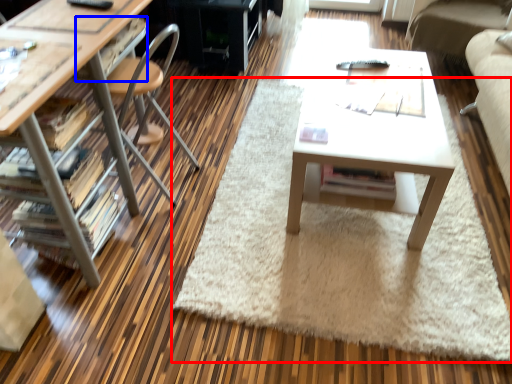
Question: Which object is further to the camera taking this photo, mat (highlighted by a red box) or drawer (highlighted by a blue box)?

Choices:
 (A) mat
 (B) drawer

Answer: (B)